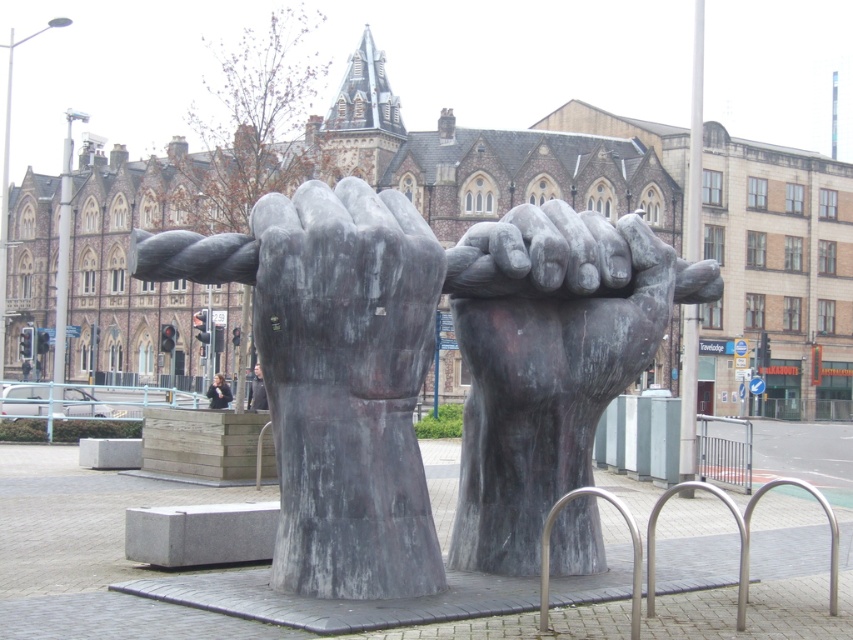
Question: Does light brown leather jacket at center appear over dark gray fabric jacket at center?

Choices:
 (A) yes
 (B) no

Answer: (B)

Question: Which of the following is the closest to the observer?

Choices:
 (A) (325, 547)
 (B) (258, 384)
 (C) (230, 397)
 (D) (555, 294)

Answer: (A)

Question: Estimate the real-world distances between objects in this image. Which object is farther from the dark gray fabric jacket at center?

Choices:
 (A) matte gray stone fists at center
 (B) light brown leather jacket at center
 (C) rustic stone fist at center

Answer: (C)

Question: Can you confirm if matte gray stone fists at center is thinner than dark gray fabric jacket at center?

Choices:
 (A) yes
 (B) no

Answer: (B)

Question: Does matte gray stone fists at center have a larger size compared to light brown leather jacket at center?

Choices:
 (A) no
 (B) yes

Answer: (A)

Question: Estimate the real-world distances between objects in this image. Which object is closer to the light brown leather jacket at center?

Choices:
 (A) dark gray fabric jacket at center
 (B) rustic stone fist at center

Answer: (A)